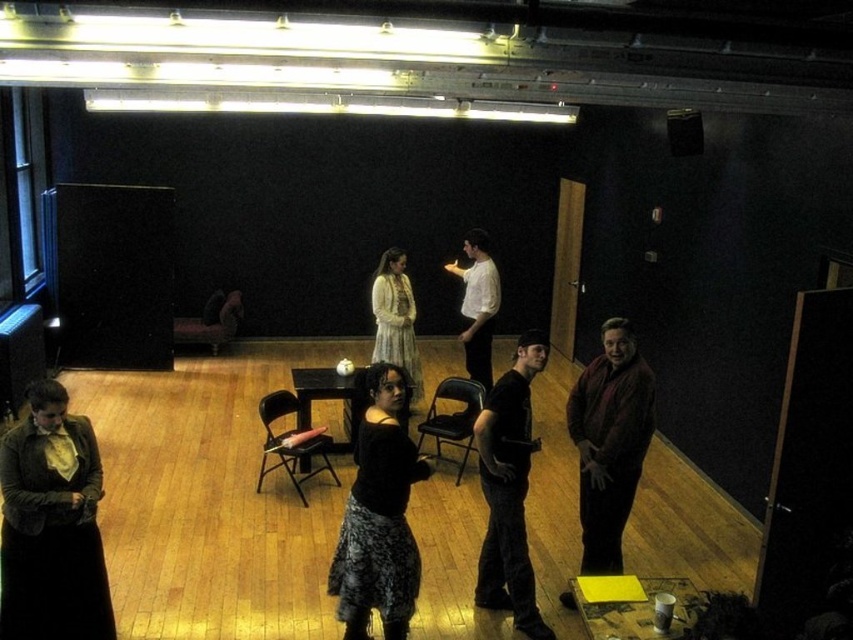
Who is higher up, matte white dress at center or white smooth shirt at center?

white smooth shirt at center is above.

Is matte white dress at center above white smooth shirt at center?

Actually, matte white dress at center is below white smooth shirt at center.

Which is behind, point (396, 301) or point (465, 333)?

Positioned behind is point (396, 301).

Where is `matte white dress at center`? This screenshot has width=853, height=640. matte white dress at center is located at coordinates (395, 320).

Find the location of a particular element. This screenshot has height=640, width=853. black matte skirt at center is located at coordinates (379, 516).

Is black matte skirt at center below matte white dress at center?

Correct, black matte skirt at center is located below matte white dress at center.

Describe the element at coordinates (379, 516) in the screenshot. I see `black matte skirt at center` at that location.

The height and width of the screenshot is (640, 853). Identify the location of black matte skirt at center. (379, 516).

Is maroon wool sweater at center below matte white dress at center?

Yes, maroon wool sweater at center is below matte white dress at center.

Does maroon wool sweater at center have a smaller size compared to matte white dress at center?

No, maroon wool sweater at center is not smaller than matte white dress at center.

Does point (646, 397) come closer to viewer compared to point (392, 285)?

Yes, it is in front of point (392, 285).

Where is `maroon wool sweater at center`? This screenshot has height=640, width=853. maroon wool sweater at center is located at coordinates (608, 442).